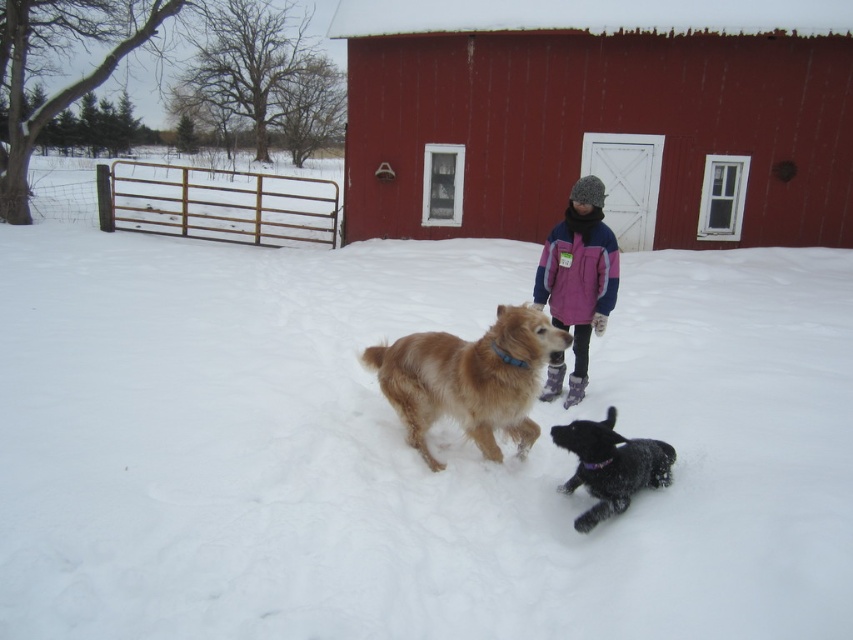
Question: Which point is farther from the camera taking this photo?

Choices:
 (A) (544, 396)
 (B) (740, 60)

Answer: (B)

Question: Does smooth wooden barn at center appear on the right side of purple fleece jacket at center?

Choices:
 (A) yes
 (B) no

Answer: (A)

Question: Which is farther from the smooth wooden barn at center?

Choices:
 (A) purple fleece jacket at center
 (B) golden fur dog at center
 (C) shiny black dog at lower right

Answer: (C)

Question: Does purple fleece jacket at center lie in front of shiny black dog at lower right?

Choices:
 (A) no
 (B) yes

Answer: (A)

Question: Which object is positioned farthest from the smooth wooden barn at center?

Choices:
 (A) purple fleece jacket at center
 (B) golden fur dog at center
 (C) shiny black dog at lower right

Answer: (C)

Question: Is the position of golden fur dog at center more distant than that of shiny black dog at lower right?

Choices:
 (A) no
 (B) yes

Answer: (B)